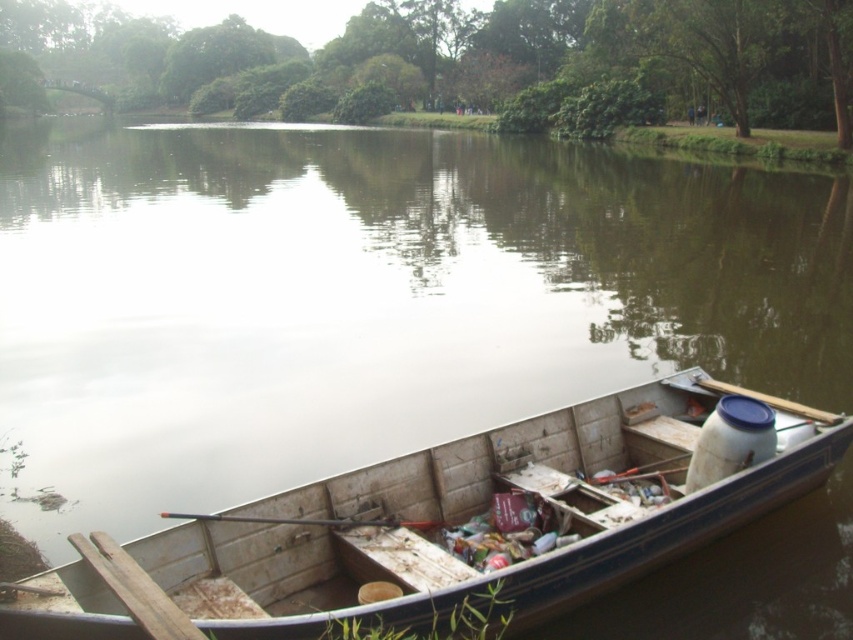
In the scene shown: Between brown wooden river at center and wooden boat at lower right, which one has more height?

With more height is brown wooden river at center.

Which is behind, point (543, 404) or point (341, 484)?

Positioned behind is point (543, 404).

Who is more forward, (15, 296) or (210, 618)?

Point (210, 618)

Identify the location of brown wooden river at center. Image resolution: width=853 pixels, height=640 pixels. (369, 300).